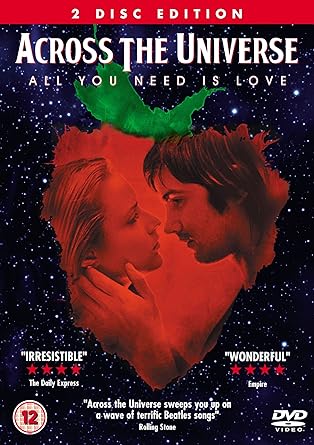
Identify the location of poster. Image resolution: width=314 pixels, height=445 pixels. (155, 132).